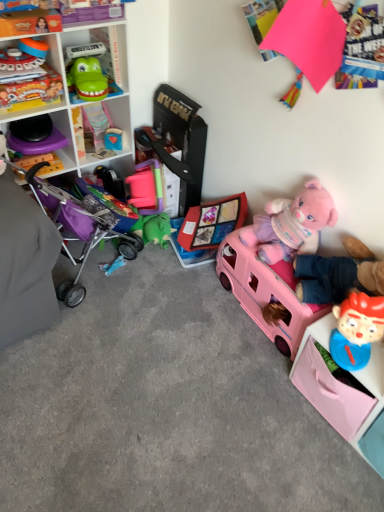
Question: Does rubber duck at center, placed as the 5th toy when sorted from right to left, have a greater height compared to pink plush bear at right, which ranks as the second toy in right-to-left order?

Choices:
 (A) no
 (B) yes

Answer: (A)

Question: Does rubber duck at center, placed as the 5th toy when sorted from right to left, have a larger size compared to pink plush bear at right, which ranks as the second toy in right-to-left order?

Choices:
 (A) no
 (B) yes

Answer: (A)

Question: Is the position of rubber duck at center, which is the 3th toy in left-to-right order, more distant than that of pink plush bear at right, which ranks as the second toy in right-to-left order?

Choices:
 (A) no
 (B) yes

Answer: (B)

Question: Is rubber duck at center, which is the 3th toy in left-to-right order, smaller than pink plush bear at right, which appears as the sixth toy when viewed from the left?

Choices:
 (A) yes
 (B) no

Answer: (A)

Question: Is rubber duck at center, which is the 3th toy in left-to-right order, oriented away from pink plush bear at right, which appears as the sixth toy when viewed from the left?

Choices:
 (A) no
 (B) yes

Answer: (A)

Question: Is rubber duck at center, which is the 3th toy in left-to-right order, aimed at pink plush bear at right, which appears as the sixth toy when viewed from the left?

Choices:
 (A) yes
 (B) no

Answer: (B)

Question: Considering the relative sizes of rubber duck at center, placed as the 5th toy when sorted from right to left, and green rubbery toy at upper left, placed as the 2th toy when sorted from left to right, in the image provided, is rubber duck at center, placed as the 5th toy when sorted from right to left, thinner than green rubbery toy at upper left, placed as the 2th toy when sorted from left to right,?

Choices:
 (A) yes
 (B) no

Answer: (A)

Question: Is rubber duck at center, placed as the 5th toy when sorted from right to left, oriented towards green rubbery toy at upper left, the sixth toy in the right-to-left sequence?

Choices:
 (A) yes
 (B) no

Answer: (B)

Question: Is there a large distance between rubber duck at center, placed as the 5th toy when sorted from right to left, and green rubbery toy at upper left, the sixth toy in the right-to-left sequence?

Choices:
 (A) no
 (B) yes

Answer: (A)

Question: Is rubber duck at center, which is the 3th toy in left-to-right order, directly adjacent to green rubbery toy at upper left, placed as the 2th toy when sorted from left to right?

Choices:
 (A) no
 (B) yes

Answer: (A)

Question: Can you confirm if rubber duck at center, placed as the 5th toy when sorted from right to left, is wider than green rubbery toy at upper left, the sixth toy in the right-to-left sequence?

Choices:
 (A) yes
 (B) no

Answer: (B)

Question: Does rubber duck at center, placed as the 5th toy when sorted from right to left, come behind green rubbery toy at upper left, placed as the 2th toy when sorted from left to right?

Choices:
 (A) no
 (B) yes

Answer: (B)

Question: Can you confirm if pink plastic shelf at lower right, which is the 1th shelf in bottom-to-top order, is smaller than green plastic toy at upper left, the 2th cabinet from the bottom?

Choices:
 (A) yes
 (B) no

Answer: (B)